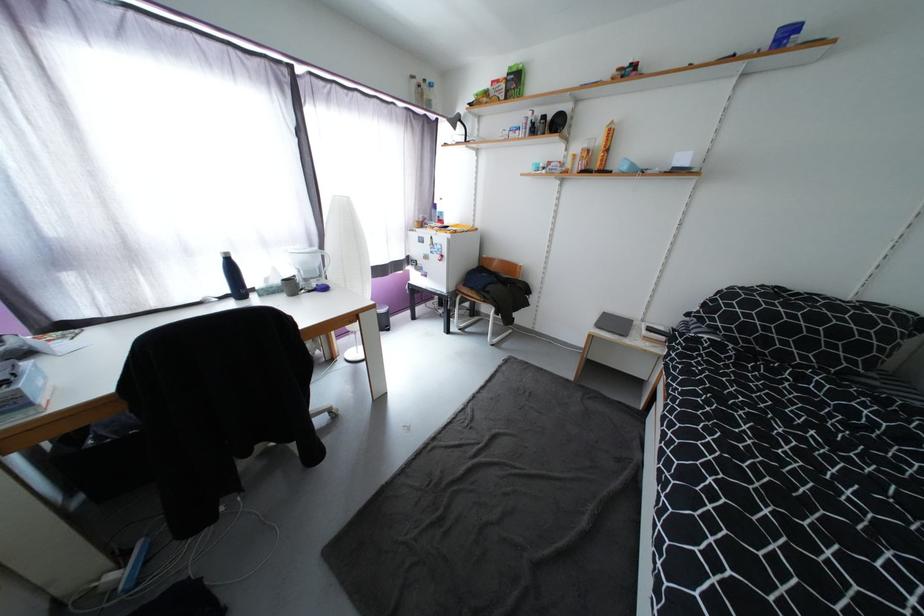
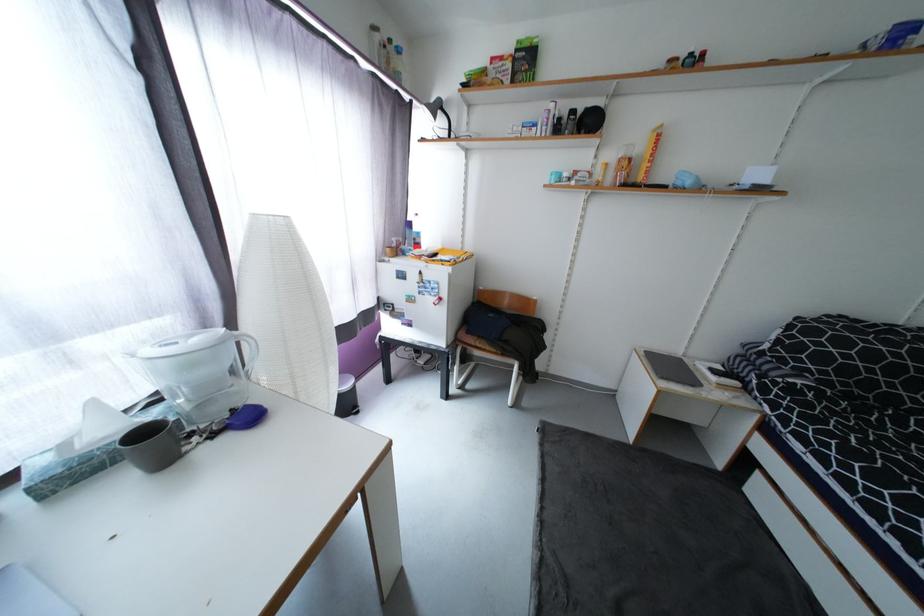
Find the pixel in the second image that matches point (322, 254) in the first image.

(226, 342)